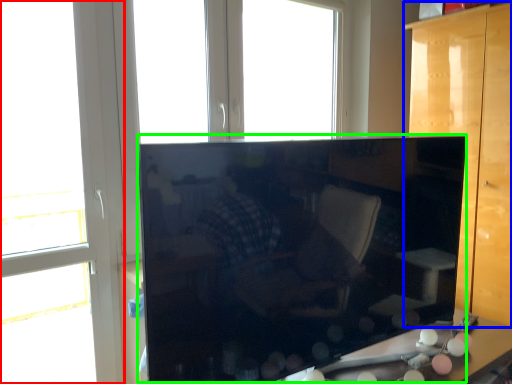
Question: Which object is the farthest from window (highlighted by a red box)? Choose among these: furniture (highlighted by a blue box) or cabinetry (highlighted by a green box).

Choices:
 (A) furniture
 (B) cabinetry

Answer: (A)